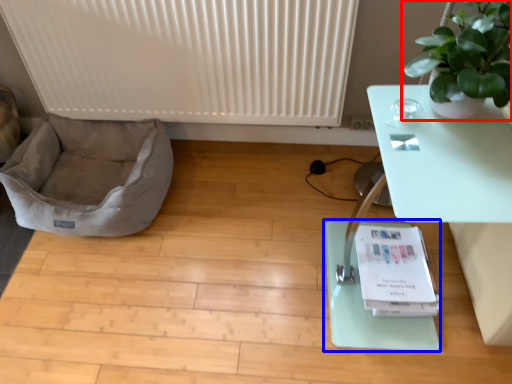
Question: Which point is closer to the camera, houseplant (highlighted by a red box) or yoga mat (highlighted by a blue box)?

Choices:
 (A) houseplant
 (B) yoga mat

Answer: (A)